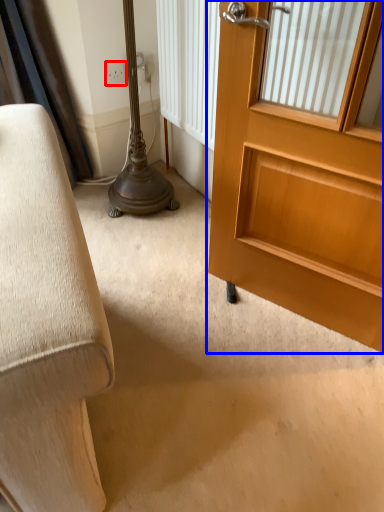
Question: Which point is further to the camera, electric outlet (highlighted by a red box) or door (highlighted by a blue box)?

Choices:
 (A) electric outlet
 (B) door

Answer: (A)